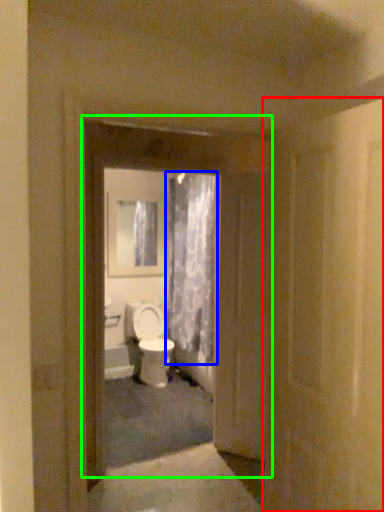
Question: Which is farther away from door (highlighted by a red box)? curtain (highlighted by a blue box) or door (highlighted by a green box)?

Choices:
 (A) curtain
 (B) door

Answer: (A)